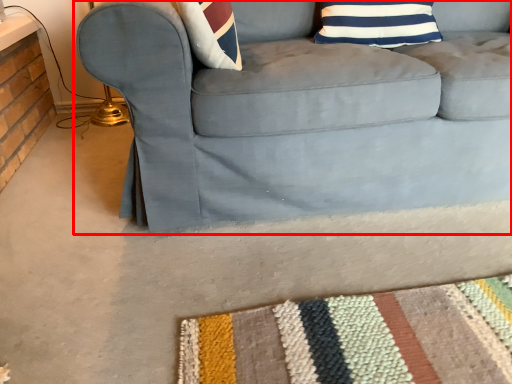
Question: Observing the image, what is the correct spatial positioning of studio couch (annotated by the red box) in reference to pillow?

Choices:
 (A) right
 (B) left

Answer: (A)